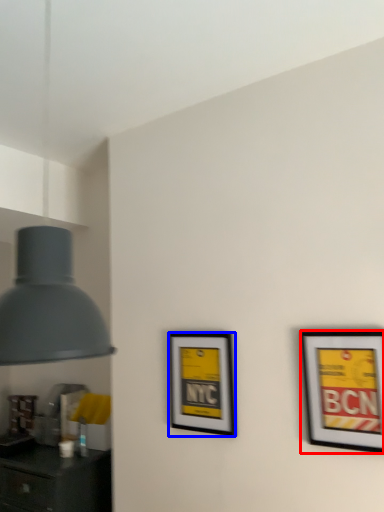
Question: Which of the following is the farthest to the observer, picture frame (highlighted by a red box) or picture frame (highlighted by a blue box)?

Choices:
 (A) picture frame
 (B) picture frame

Answer: (B)